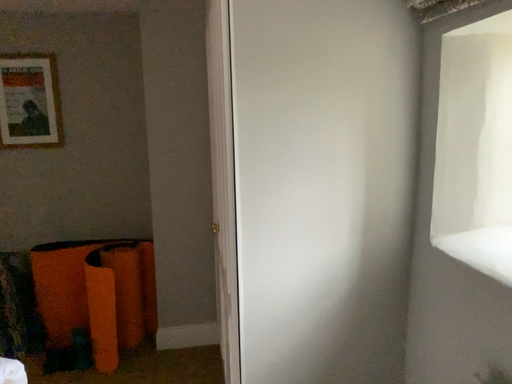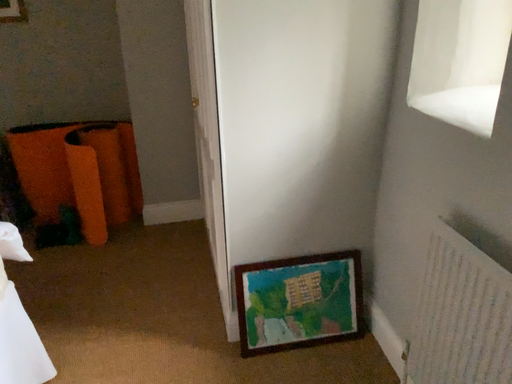
Question: How did the camera likely rotate when shooting the video?

Choices:
 (A) rotated downward
 (B) rotated upward

Answer: (A)